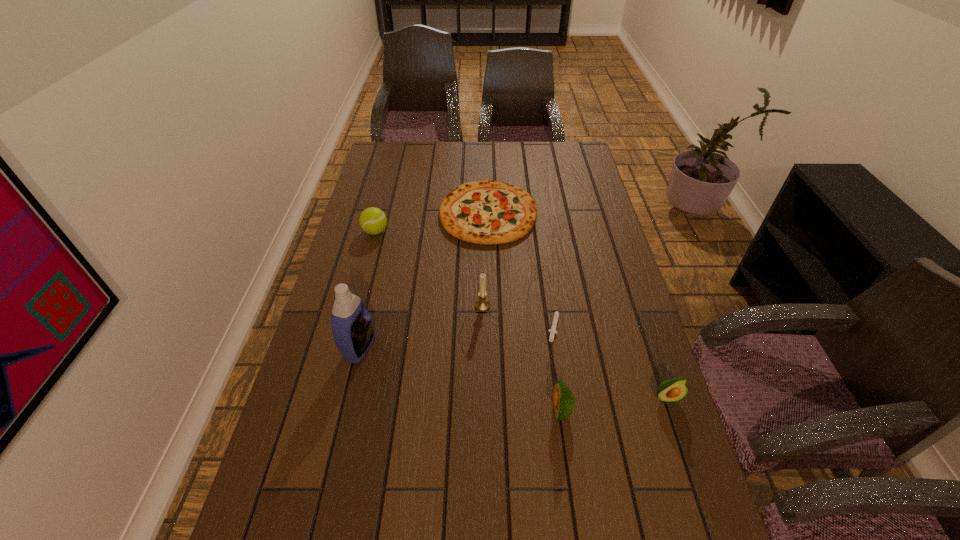
Identify the location of vacant area between the detergent and the syringe. (457, 335).

Where is `free spot between the tallest object and the shortest object`? Image resolution: width=960 pixels, height=540 pixels. free spot between the tallest object and the shortest object is located at coordinates (457, 335).

This screenshot has width=960, height=540. In order to click on free space between the pizza and the tennis ball in this screenshot , I will do `click(432, 222)`.

Where is `free spot between the sixth tallest object and the taller avocado`? free spot between the sixth tallest object and the taller avocado is located at coordinates (524, 312).

The height and width of the screenshot is (540, 960). In order to click on empty location between the tallest object and the syringe in this screenshot , I will do `click(457, 335)`.

The image size is (960, 540). What are the coordinates of `free space between the shortest object and the pizza` in the screenshot? It's located at [521, 268].

You are a GUI agent. You are given a task and a screenshot of the screen. Output one action in this format:
    pyautogui.click(x=<x>, y=<y>)
    Task: Click on the object that is the second closest to the tennis ball
    
    Given the screenshot: What is the action you would take?
    pyautogui.click(x=352, y=327)

You are a GUI agent. You are given a task and a screenshot of the screen. Output one action in this format:
    pyautogui.click(x=<x>, y=<y>)
    Task: Click on the object that is the fourth closest to the rightmost object
    
    Given the screenshot: What is the action you would take?
    pyautogui.click(x=488, y=212)

Locate an element on the screen. vacant space that satisfies the following two spatial constraints: 1. on the front side of the tennis ball; 2. on the right side of the candle holder is located at coordinates (356, 306).